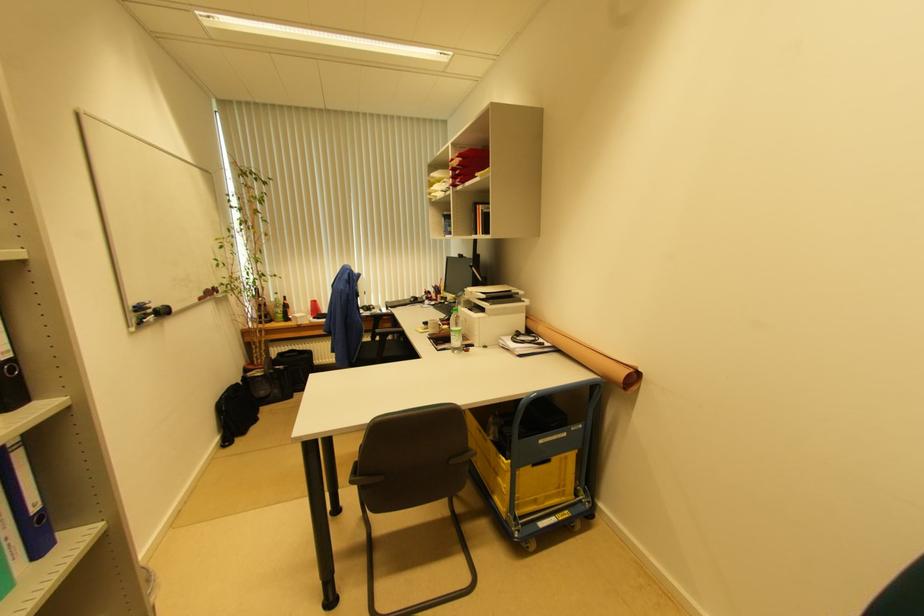
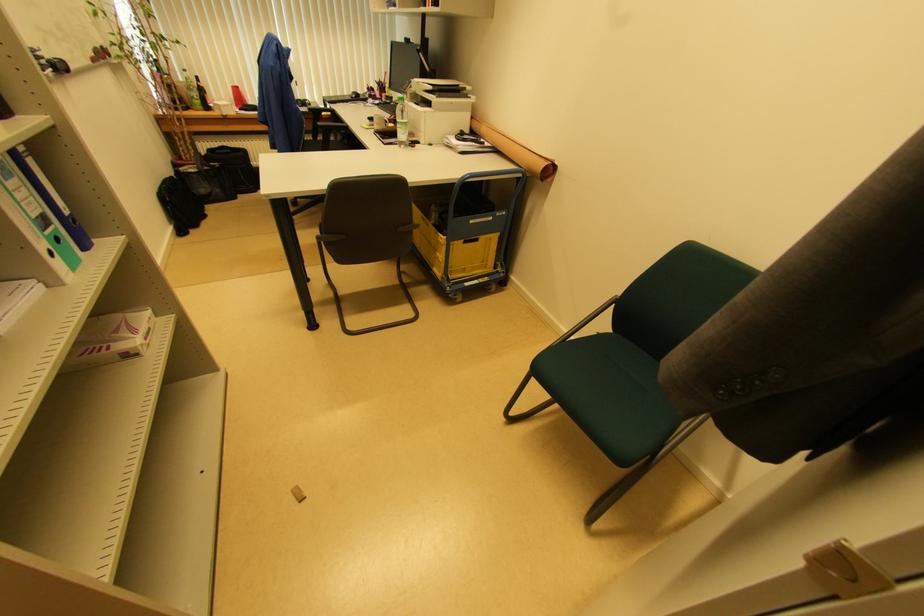
The point at (499, 477) is marked in the first image. Where is the corresponding point in the second image?

(438, 253)